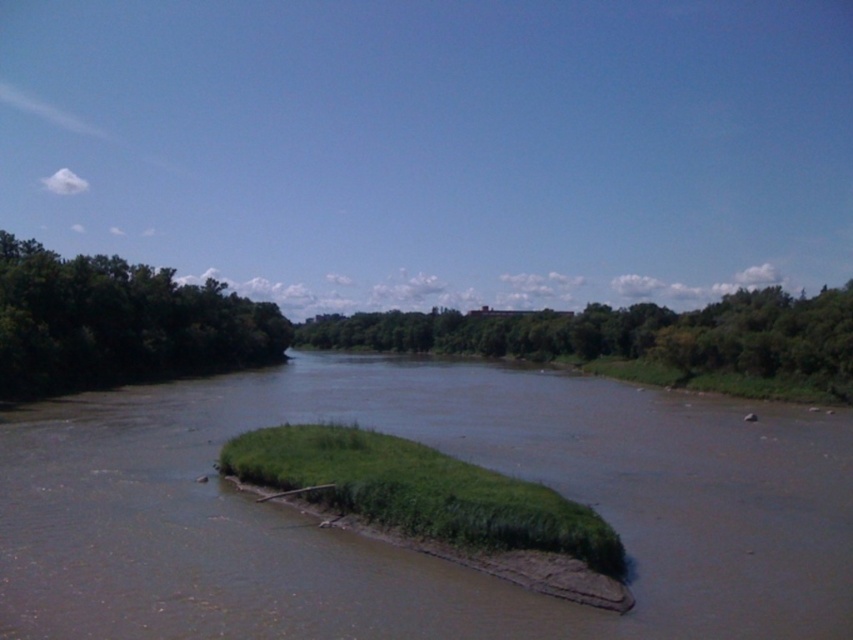
Question: Observing the image, what is the correct spatial positioning of green leafy trees at center in reference to green leafy trees at left?

Choices:
 (A) below
 (B) above

Answer: (A)

Question: Which of the following is the closest to the observer?

Choices:
 (A) (149, 499)
 (B) (755, 333)
 (C) (201, 296)

Answer: (A)

Question: Which of the following is the farthest from the observer?

Choices:
 (A) (22, 301)
 (B) (399, 326)

Answer: (B)

Question: Can you confirm if brown muddy river at center is smaller than green grassy island at center?

Choices:
 (A) no
 (B) yes

Answer: (A)

Question: Estimate the real-world distances between objects in this image. Which object is closer to the green leafy trees at left?

Choices:
 (A) brown muddy river at center
 (B) green leafy trees at center
 (C) green grassy island at center

Answer: (A)

Question: Is green leafy trees at center behind green grassy island at center?

Choices:
 (A) yes
 (B) no

Answer: (A)